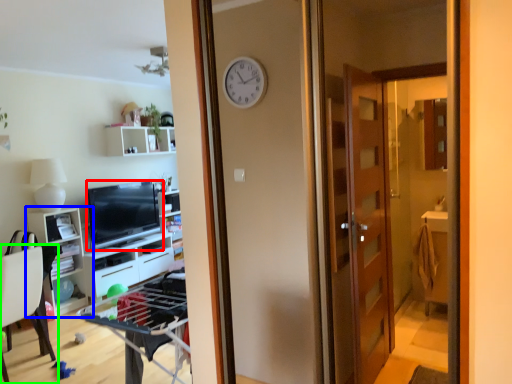
Question: Which object is the farthest from television (highlighted by a red box)? Choose among these: cabinetry (highlighted by a blue box) or chair (highlighted by a green box).

Choices:
 (A) cabinetry
 (B) chair

Answer: (B)